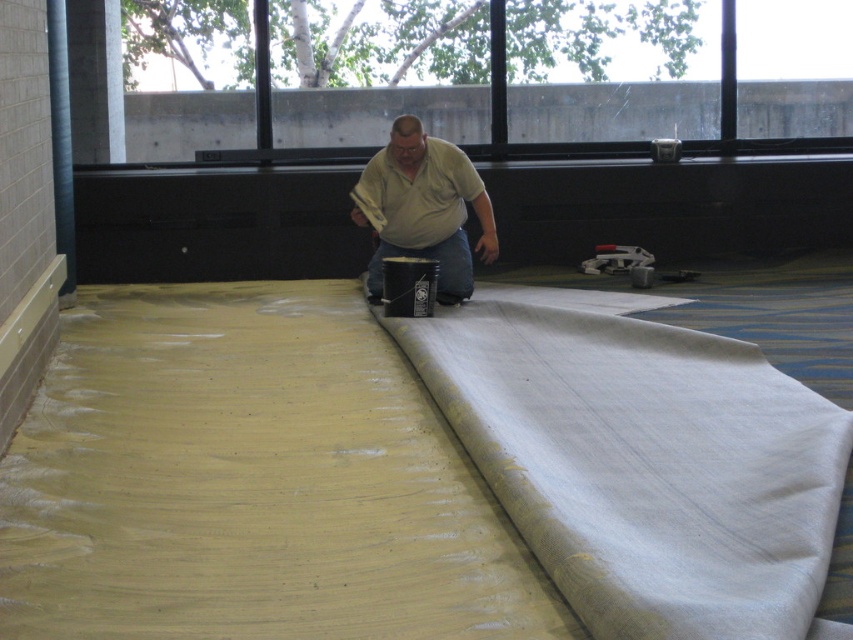
Which is above, white fabric at center or matte beige shirt at center?

matte beige shirt at center

Is white fabric at center wider than matte beige shirt at center?

Yes, white fabric at center is wider than matte beige shirt at center.

Measure the distance between point (606, 376) and camera.

Point (606, 376) is 14.35 feet away from camera.

The width and height of the screenshot is (853, 640). I want to click on white fabric at center, so click(643, 464).